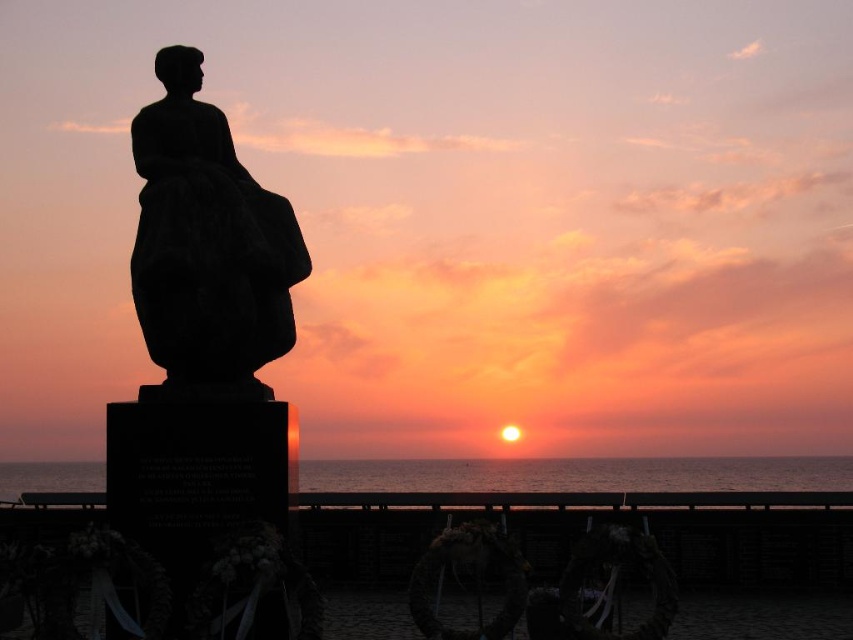
You are a photographer planning to capture the sunset with both the black stone statue at left and the smooth ocean water at center in the frame. Based on their heights, which object will appear larger in the photo?

The black stone statue at left will appear larger in the photo because it is taller than the smooth ocean water at center.

You are a photographer wanting to capture the black stone statue at left and the smooth ocean water at center in the same frame. Based on their positions, can you determine which object is closer to the camera?

The black stone statue at left is in front of smooth ocean water at center, so the statue is closer to the camera than the ocean water.

You are an artist planning to sketch this sunset scene. You want to ensure the black stone statue at left and the smooth ocean water at center are proportionally accurate. Which object should you draw with a narrower width in your sketch?

The black stone statue at left should be drawn with a narrower width than the smooth ocean water at center because the description states that the black stone statue at left is thinner than the smooth ocean water at center.